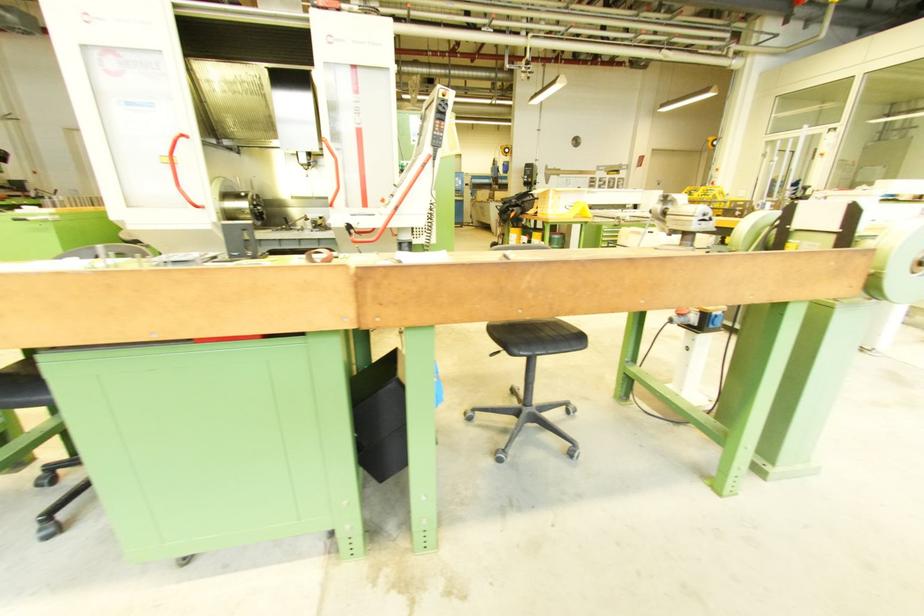
Which object does [436,131] point to?

It corresponds to the machine control pendant in the image.